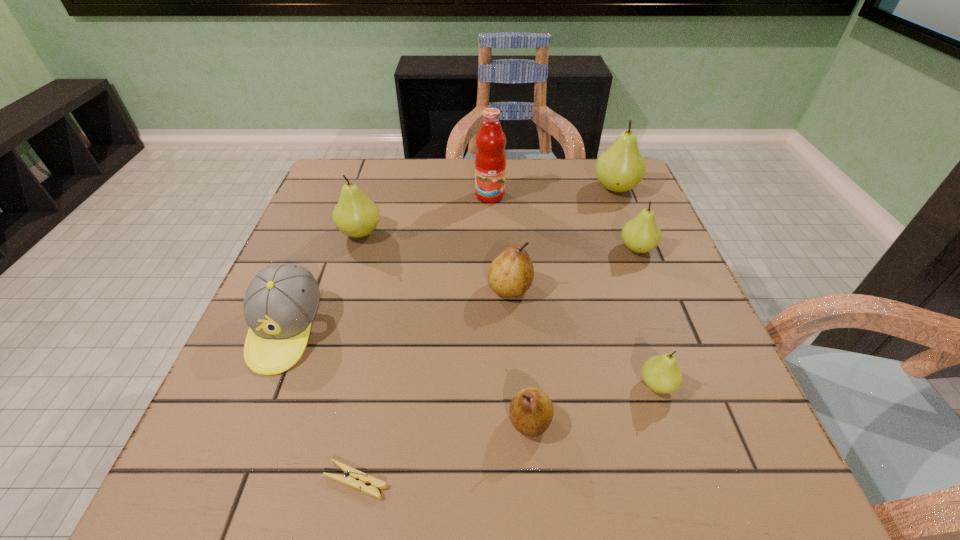
Where is `free point at the right edge`? free point at the right edge is located at coordinates (631, 284).

Image resolution: width=960 pixels, height=540 pixels. I want to click on vacant space at the near left corner of the desktop, so click(x=291, y=458).

You are a GUI agent. You are given a task and a screenshot of the screen. Output one action in this format:
    pyautogui.click(x=<x>, y=<y>)
    Task: Click on the free space between the nearest green pear and the tallest object
    This screenshot has width=960, height=540.
    Given the screenshot: What is the action you would take?
    pyautogui.click(x=573, y=291)

Find the location of `free space between the tallest object and the farther brown pear`. free space between the tallest object and the farther brown pear is located at coordinates (500, 242).

Find the location of a particular element. Image resolution: width=960 pixels, height=540 pixels. blank region between the second tallest object and the seventh shortest object is located at coordinates (488, 211).

Where is `free space between the fruit juice and the second smallest green pear`? Image resolution: width=960 pixels, height=540 pixels. free space between the fruit juice and the second smallest green pear is located at coordinates (564, 222).

I want to click on free spot between the tallest object and the baseball cap, so click(388, 263).

Find the location of a particular element. The width and height of the screenshot is (960, 540). vacant point located between the second smallest green pear and the smallest green pear is located at coordinates (647, 317).

The image size is (960, 540). Identify the location of empty space that is in between the nearer brown pear and the baseball cap. (408, 376).

The width and height of the screenshot is (960, 540). Identify the location of vacant area between the tallest object and the nearest green pear. (573, 291).